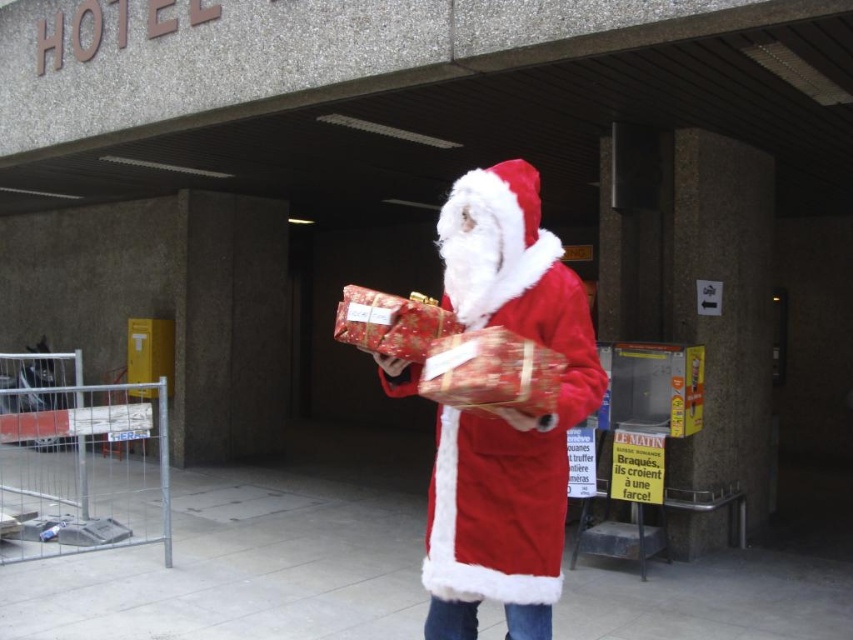
Question: Which point is closer to the camera taking this photo?

Choices:
 (A) (424, 320)
 (B) (384, 358)

Answer: (A)

Question: From the image, what is the correct spatial relationship of fuzzy red coat at center in relation to shiny red wrapping paper at center?

Choices:
 (A) above
 (B) below

Answer: (B)

Question: Does fuzzy red coat at center have a smaller size compared to shiny red wrapping paper at center?

Choices:
 (A) no
 (B) yes

Answer: (A)

Question: Is fuzzy red coat at center bigger than shiny red wrapping paper at center?

Choices:
 (A) yes
 (B) no

Answer: (A)

Question: Which of the following is the farthest from the observer?

Choices:
 (A) fuzzy red coat at center
 (B) shiny red wrapping paper at center

Answer: (A)